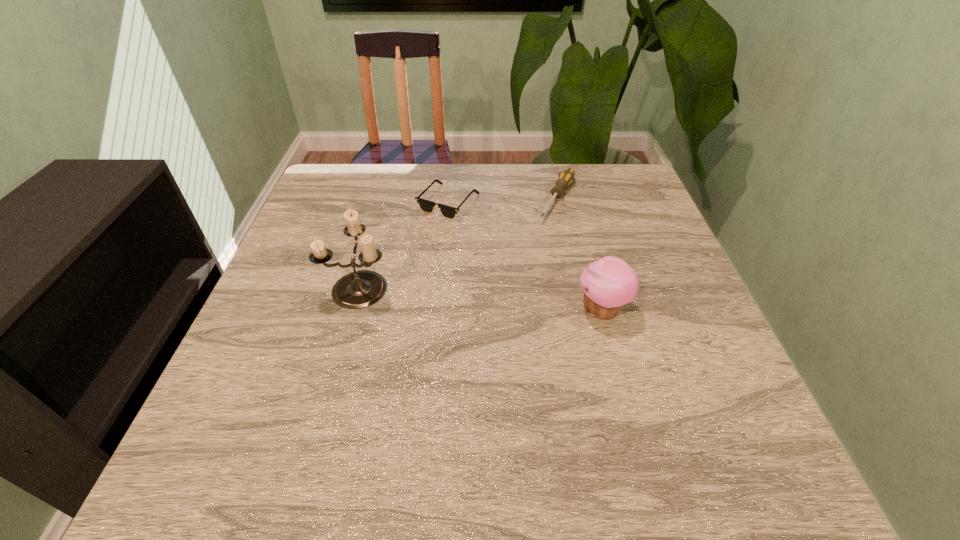
What are the coordinates of `free space located at the tip of the screwdriver` in the screenshot? It's located at (495, 317).

You are a GUI agent. You are given a task and a screenshot of the screen. Output one action in this format:
    pyautogui.click(x=<x>, y=<y>)
    Task: Click on the blank space located on the lenses of the shortest object
    
    Given the screenshot: What is the action you would take?
    pyautogui.click(x=447, y=294)

Find the location of a particular element. vacant space positioned 0.090m on the lenses of the shortest object is located at coordinates (447, 244).

This screenshot has width=960, height=540. In order to click on blank area located on the lenses of the shortest object in this screenshot , I will do `click(447, 285)`.

You are a GUI agent. You are given a task and a screenshot of the screen. Output one action in this format:
    pyautogui.click(x=<x>, y=<y>)
    Task: Click on the screwdriver situated at the far edge
    This screenshot has width=960, height=540.
    Given the screenshot: What is the action you would take?
    pyautogui.click(x=565, y=178)

Locate an element on the screen. sunglasses present at the far edge is located at coordinates (427, 206).

Identify the location of object present at the left edge. (359, 289).

I want to click on object that is at the right edge, so click(609, 283).

In order to click on vacant space at the far edge of the desktop in this screenshot , I will do `click(569, 199)`.

Locate an element on the screen. Image resolution: width=960 pixels, height=540 pixels. vacant area at the near edge of the desktop is located at coordinates (599, 397).